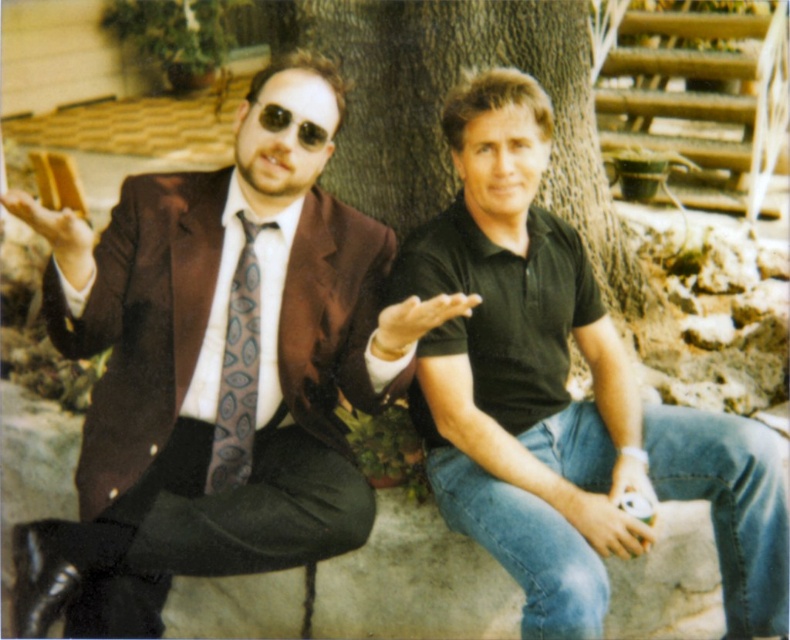
You are a photographer setting up a portrait shoot. You have a small 12cm wide reflector that you want to place between the shiny brown suit at center and the sunglasses at center to bounce light onto the subject. Given the size difference between the two objects, will the reflector fit snugly between them without overlapping either?

The shiny brown suit at center has a larger size compared to sunglasses at center. Since the reflector is 12cm wide, it can fit snugly between them as the space between the two objects is likely sufficient given the size difference.

You are a tailor measuring two items in the image. You need to determine if a 22 inch long measuring tape can reach from the shiny brown suit at center to the sunglasses at center. Can it?

The distance between the shiny brown suit at center and the sunglasses at center is 21.77 inches, so yes, the 22 inch measuring tape can reach between them since it is slightly longer than the distance.